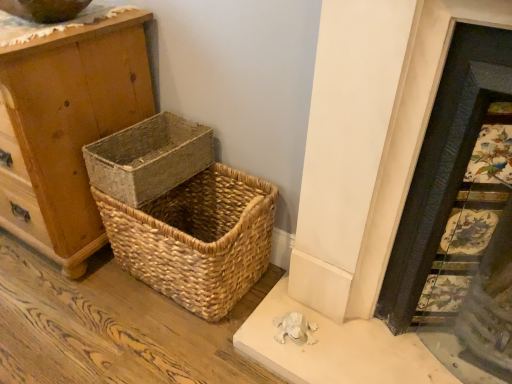
Question: From the image's perspective, is decorative tile fireplace at right located above or below wooden chest of drawers at left?

Choices:
 (A) below
 (B) above

Answer: (A)

Question: Is decorative tile fireplace at right wider or thinner than wooden chest of drawers at left?

Choices:
 (A) wide
 (B) thin

Answer: (B)

Question: Which object is positioned farthest from the natural woven basket at center, which is the second picnic basket in bottom-to-top order?

Choices:
 (A) decorative tile fireplace at right
 (B) natural woven picnic basket at lower left, marked as the 1th picnic basket in a bottom-to-top arrangement
 (C) wooden chest of drawers at left

Answer: (A)

Question: Which of these objects is positioned closest to the natural woven picnic basket at lower left, marked as the 1th picnic basket in a bottom-to-top arrangement?

Choices:
 (A) decorative tile fireplace at right
 (B) wooden chest of drawers at left
 (C) natural woven basket at center, which is the second picnic basket in bottom-to-top order

Answer: (C)